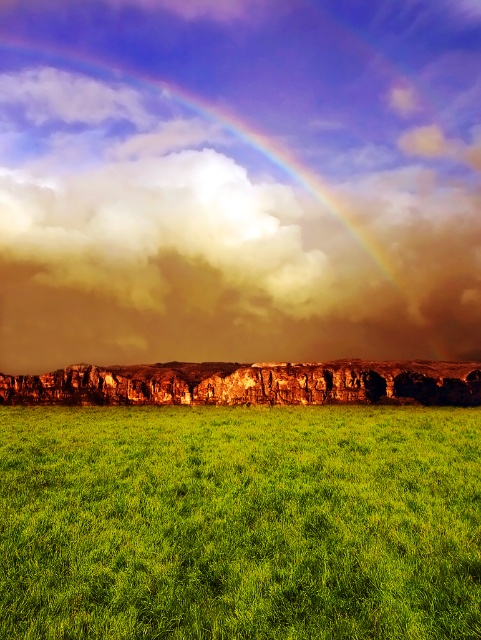
Who is higher up, cloudymaterial/texture at upper center or green grassy field at center?

cloudymaterial/texture at upper center is higher up.

Does cloudymaterial/texture at upper center have a smaller size compared to green grassy field at center?

No, cloudymaterial/texture at upper center is not smaller than green grassy field at center.

Image resolution: width=481 pixels, height=640 pixels. What are the coordinates of `cloudymaterial/texture at upper center` in the screenshot? It's located at (239, 180).

You are a GUI agent. You are given a task and a screenshot of the screen. Output one action in this format:
    pyautogui.click(x=<x>, y=<y>)
    Task: Click on the cloudymaterial/texture at upper center
    This screenshot has height=640, width=481.
    Given the screenshot: What is the action you would take?
    click(239, 180)